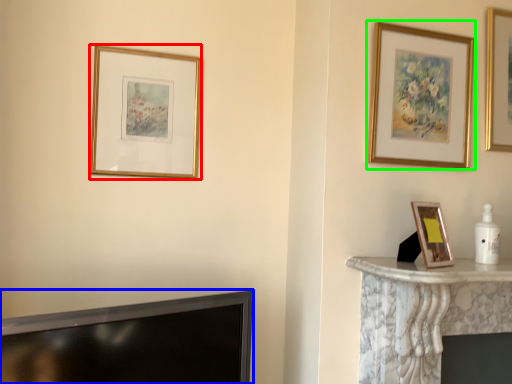
Question: Considering the real-world distances, which object is closest to picture frame (highlighted by a red box)? television (highlighted by a blue box) or picture frame (highlighted by a green box).

Choices:
 (A) television
 (B) picture frame

Answer: (A)